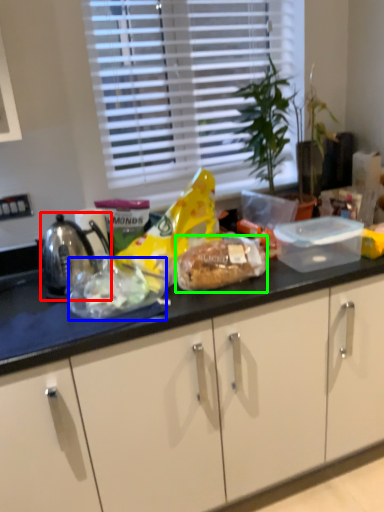
Question: Which object is positioned closest to kettle (highlighted by a red box)? Select from food (highlighted by a blue box) and snack (highlighted by a green box).

Choices:
 (A) food
 (B) snack

Answer: (A)